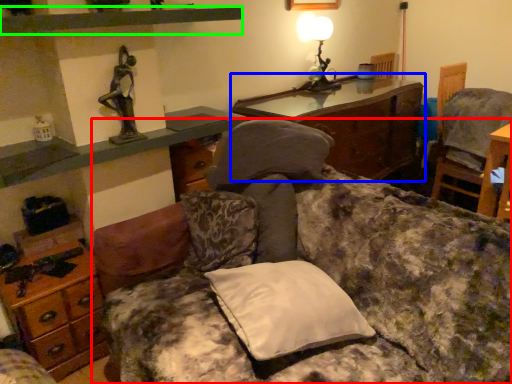
Question: Which is nearer to the studio couch (highlighted by a red box)? nightstand (highlighted by a blue box) or shelf (highlighted by a green box).

Choices:
 (A) nightstand
 (B) shelf

Answer: (B)